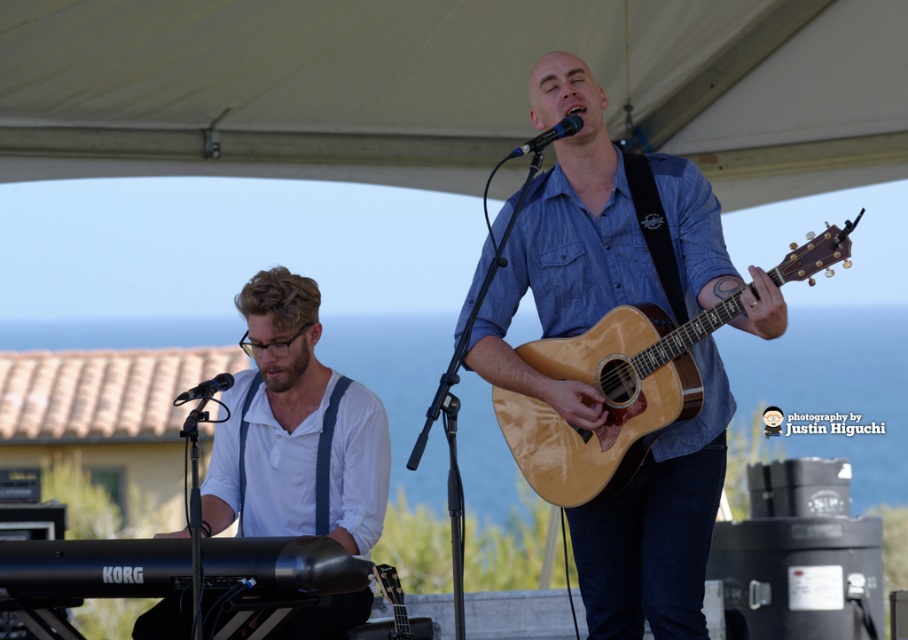
Is denim shirt at center above white cotton shirt at left?

Yes, denim shirt at center is above white cotton shirt at left.

Which of these two, denim shirt at center or white cotton shirt at left, stands shorter?

white cotton shirt at left is shorter.

You are a GUI agent. You are given a task and a screenshot of the screen. Output one action in this format:
    pyautogui.click(x=<x>, y=<y>)
    Task: Click on the denim shirt at center
    The image size is (908, 640).
    Given the screenshot: What is the action you would take?
    pyautogui.click(x=597, y=241)

Who is lower down, denim shirt at center or glossy wood guitar at center?

Positioned lower is glossy wood guitar at center.

Based on the photo, can you confirm if denim shirt at center is positioned to the right of glossy wood guitar at center?

No, denim shirt at center is not to the right of glossy wood guitar at center.

Locate an element on the screen. Image resolution: width=908 pixels, height=640 pixels. denim shirt at center is located at coordinates (597, 241).

Where is `denim shirt at center`? The width and height of the screenshot is (908, 640). denim shirt at center is located at coordinates (597, 241).

Between point (369, 596) and point (608, 483), which one is positioned in front?

Positioned in front is point (608, 483).

Is white cotton shirt at left bigger than glossy wood guitar at center?

Indeed, white cotton shirt at left has a larger size compared to glossy wood guitar at center.

Does point (314, 340) come farther from viewer compared to point (678, 356)?

Yes, it is.

Identify the location of white cotton shirt at left. (295, 429).